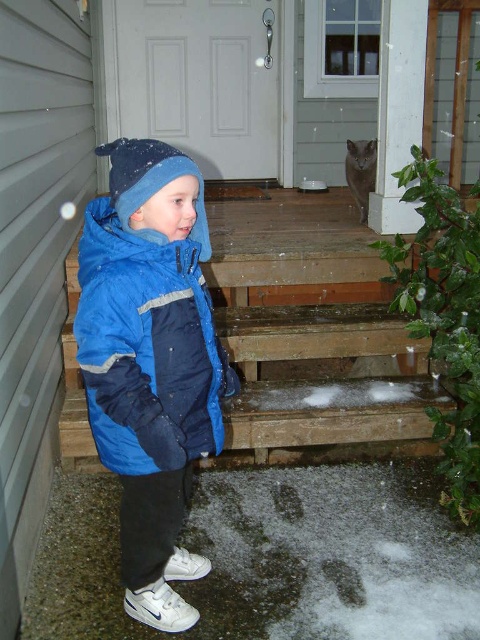
You are a delivery person trying to reach the front door of the house. You see the blue fleece jacket at left and the wooden stairs at lower center. Which object is closer to the door?

The wooden stairs at lower center are closer to the door because the stairs are part of the porch leading up to the door, while the blue fleece jacket at left is worn by the child standing on the ground near the entrance, placing it farther away from the door.

You are a delivery person with a package that needs to be delivered to the house. You are standing at the wooden stairs at lower center. The blue fleece jacket at left is an obstacle. Can you walk around it to reach the house entrance without moving the jacket?

The blue fleece jacket at left is 3.80 feet away from wooden stairs at lower center. Since the distance is sufficient, you can walk around the blue fleece jacket at left to reach the house entrance without moving it.